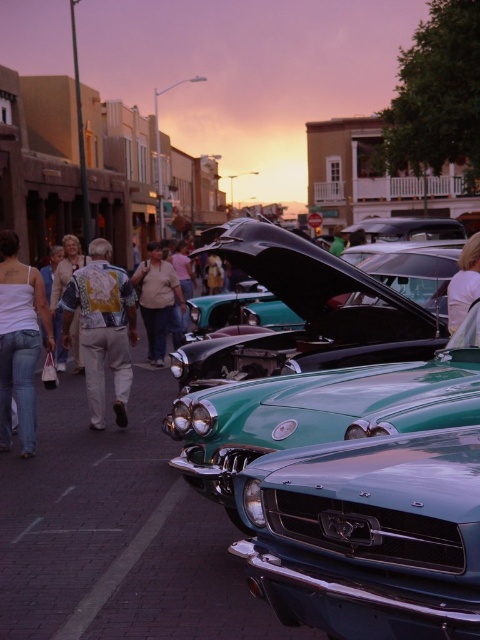
Question: Which object is closer to the camera taking this photo?

Choices:
 (A) light brown hair at center
 (B) shiny teal car at center

Answer: (B)

Question: Which of the following is the farthest from the observer?

Choices:
 (A) printed fabric shirt at center
 (B) white denim jeans at left
 (C) light brown leather jacket at center
 (D) shiny teal car at center

Answer: (C)

Question: Does shiny teal car at center appear on the left side of printed fabric shirt at center?

Choices:
 (A) no
 (B) yes

Answer: (A)

Question: Observing the image, what is the correct spatial positioning of shiny teal car at center in reference to white denim jeans at left?

Choices:
 (A) above
 (B) below

Answer: (B)

Question: Can you confirm if shiny teal car at center is positioned to the left of light brown leather jacket at center?

Choices:
 (A) yes
 (B) no

Answer: (B)

Question: Which object is closer to the camera taking this photo?

Choices:
 (A) light brown hair at center
 (B) light brown leather jacket at center

Answer: (A)